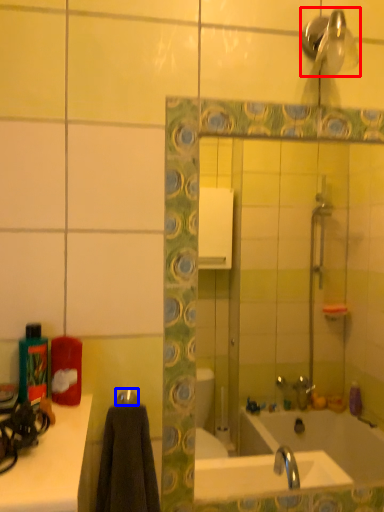
Question: Among these objects, which one is farthest to the camera, shower (highlighted by a red box) or towel bar (highlighted by a blue box)?

Choices:
 (A) shower
 (B) towel bar

Answer: (B)